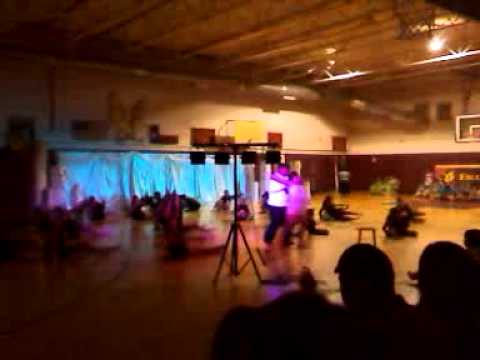
Find the location of a particular element. floor is located at coordinates (321, 246).